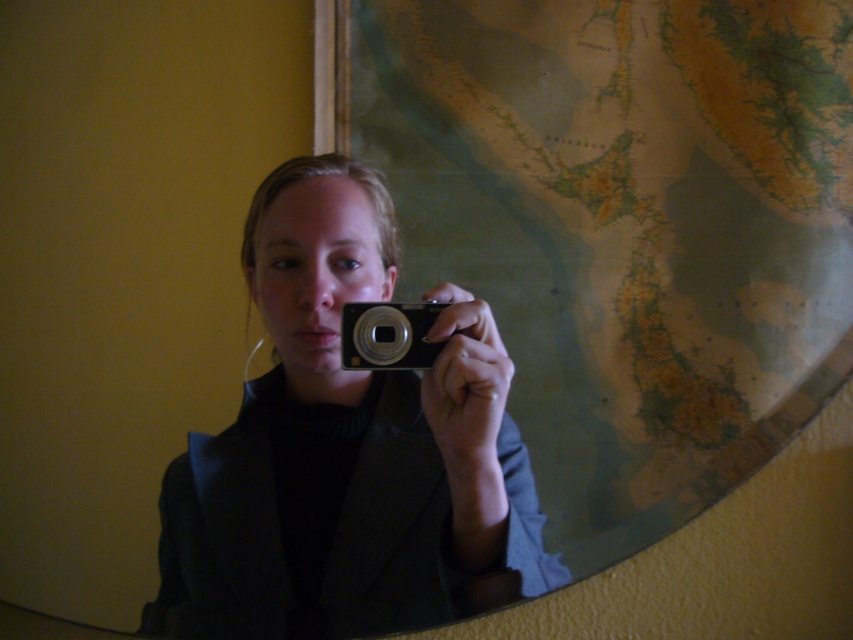
Question: Among these points, which one is nearest to the camera?

Choices:
 (A) (415, 323)
 (B) (390, 589)

Answer: (A)

Question: Is matte black camera at center thinner than silver metallic camera at center?

Choices:
 (A) yes
 (B) no

Answer: (B)

Question: Which of the following is the closest to the observer?

Choices:
 (A) silver metallic camera at center
 (B) matte black camera at center

Answer: (B)

Question: Is matte black camera at center behind silver metallic camera at center?

Choices:
 (A) yes
 (B) no

Answer: (B)

Question: Where is matte black camera at center located in relation to silver metallic camera at center in the image?

Choices:
 (A) below
 (B) above

Answer: (A)